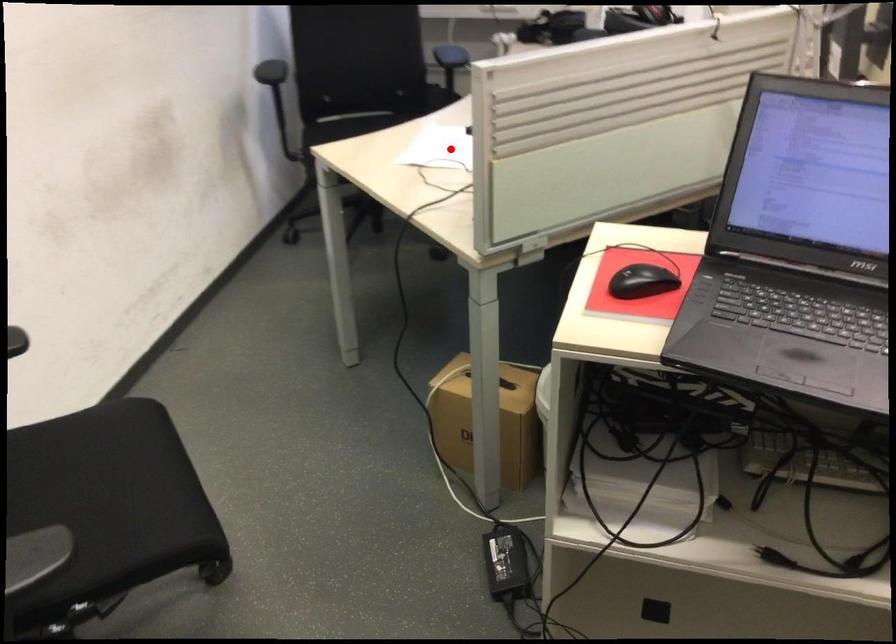
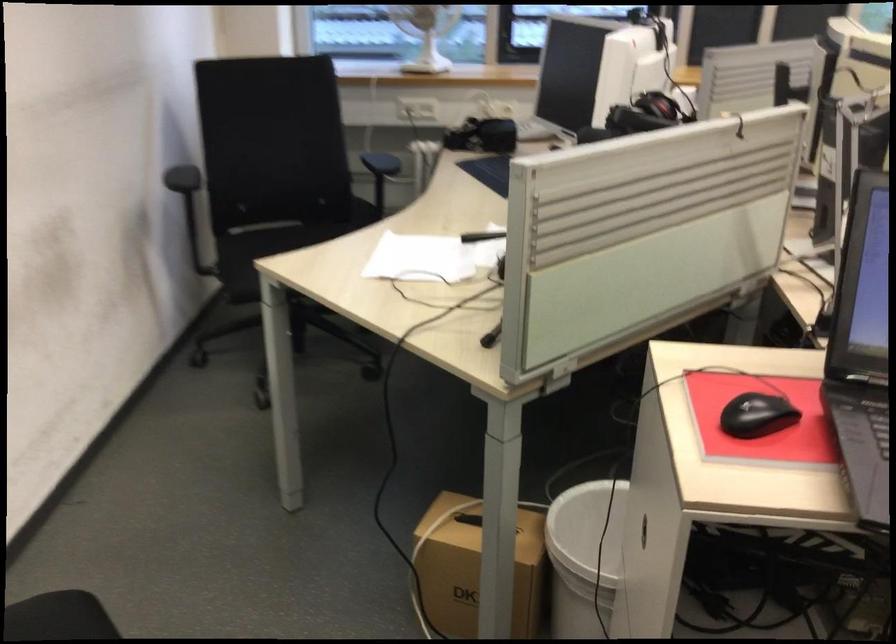
In the second image, find the point that corresponds to the highlighted location in the first image.

(419, 259)